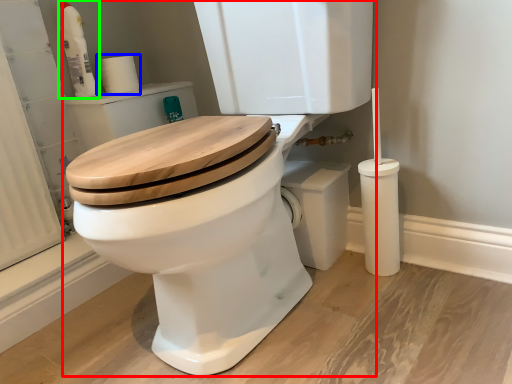
Question: Which object is positioned closest to toilet (highlighted by a red box)? Select from toilet paper (highlighted by a blue box) and cleaning product (highlighted by a green box).

Choices:
 (A) toilet paper
 (B) cleaning product

Answer: (A)